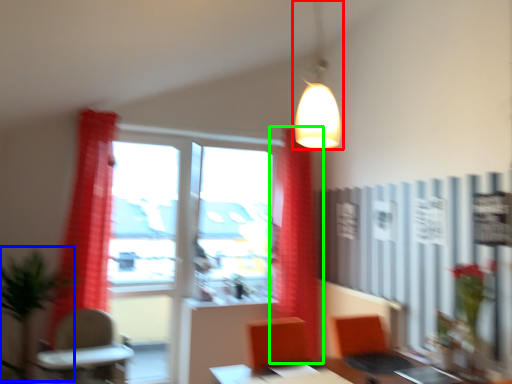
Question: Based on their relative distances, which object is farther from lamp (highlighted by a red box)? Choose from plant (highlighted by a blue box) and curtain (highlighted by a green box).

Choices:
 (A) plant
 (B) curtain

Answer: (A)